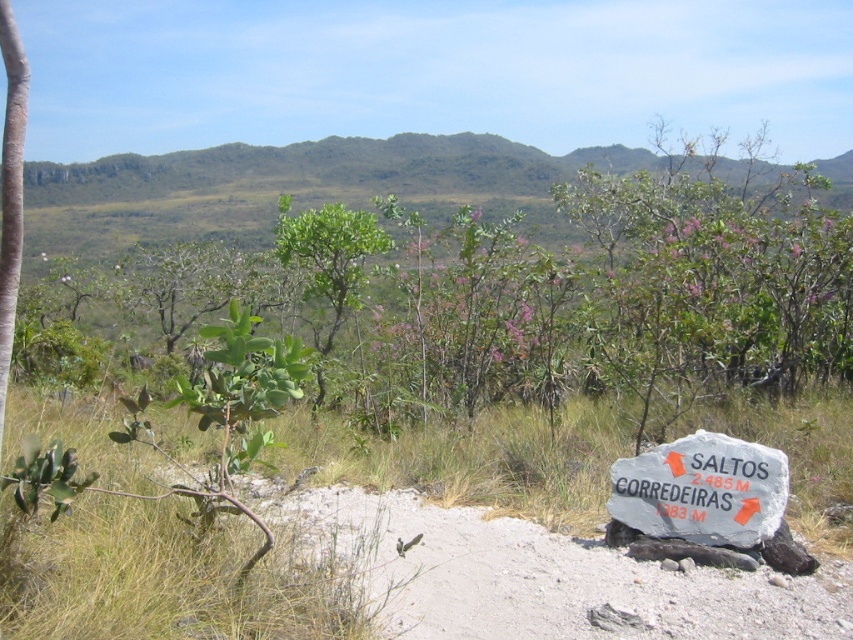
You are standing at the signpost and want to take a photo of the green leafy tree at center. If your camera has a maximum focus range of 35 feet, will you need to move closer to the tree to capture it clearly?

The green leafy tree at center is 37.43 feet away from the viewer. Since the camera can only focus up to 35 feet, you need to move closer to the tree to ensure it is in focus.

You are standing at the starting point of the trail and see the green leafy tree at center and the gray stone sign at lower right. Which object is closer to your current position?

The gray stone sign at lower right is closer to your current position because it is located at the lower right, which is typically near the viewer in such images, whereas the green leafy tree at center is positioned to the left of it, likely further away.